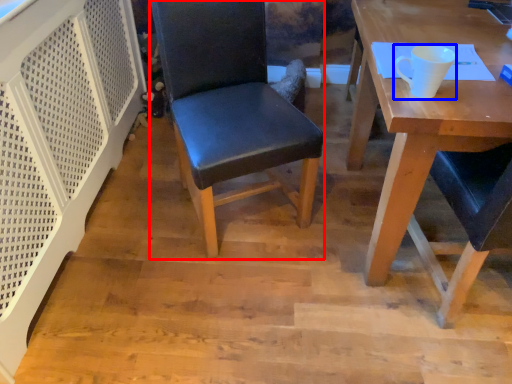
Question: Which object appears farthest to the camera in this image, chair (highlighted by a red box) or coffee cup (highlighted by a blue box)?

Choices:
 (A) chair
 (B) coffee cup

Answer: (A)